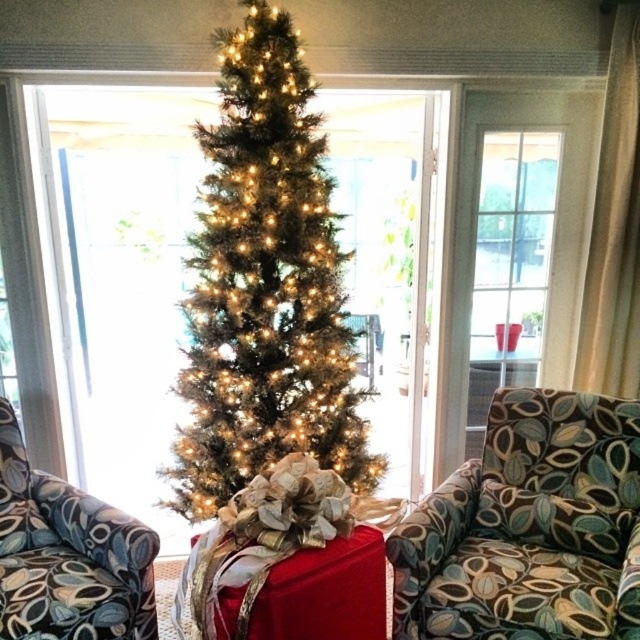
You are sitting in the patterned fabric armchair at center and want to move to the patterned fabric armchair at left. Which direction should you move to reach it?

The patterned fabric armchair at center is positioned under the patterned fabric armchair at left, so you should move upward to reach it.

Based on the scene description, where is the green textured christmas tree at center located in the image?

The green textured christmas tree at center is located at point (264, 285).